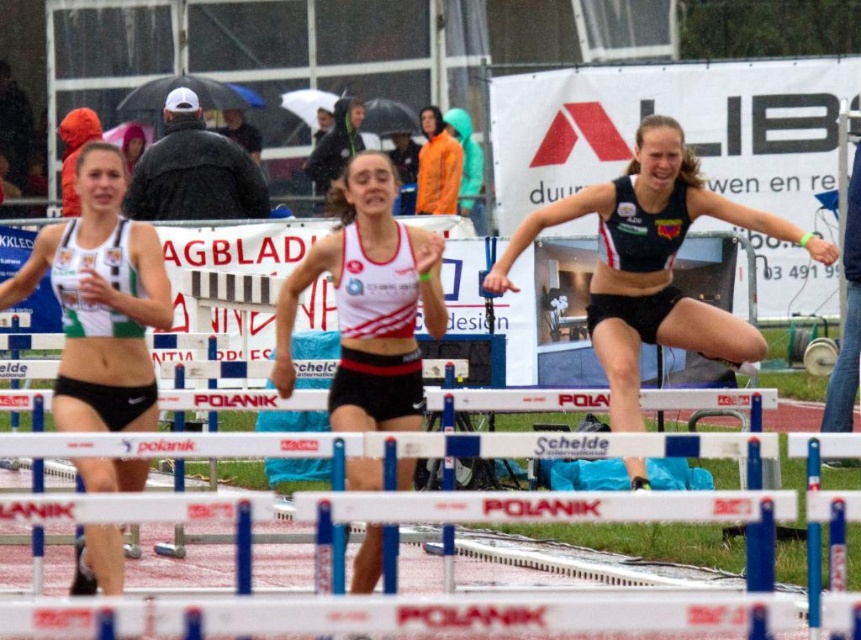
Question: Which object appears farthest from the camera in this image?

Choices:
 (A) matte black shorts at center
 (B) orange nylon jacket at upper center
 (C) white plastic hurdle at center

Answer: (B)

Question: Which point is farther from the camera taking this photo?

Choices:
 (A) (455, 147)
 (B) (327, 496)
 (C) (358, 294)

Answer: (A)

Question: Where is green and white athletic top at left located in relation to orange nylon jacket at upper center in the image?

Choices:
 (A) below
 (B) above

Answer: (A)

Question: Which object is the farthest from the white plastic hurdle at center?

Choices:
 (A) matte black shorts at center
 (B) white matte tank top at center

Answer: (A)

Question: Can you confirm if green and white athletic top at left is positioned to the right of white matte tank top at center?

Choices:
 (A) no
 (B) yes

Answer: (A)

Question: Observing the image, what is the correct spatial positioning of green and white athletic top at left in reference to white matte tank top at center?

Choices:
 (A) above
 (B) below

Answer: (B)